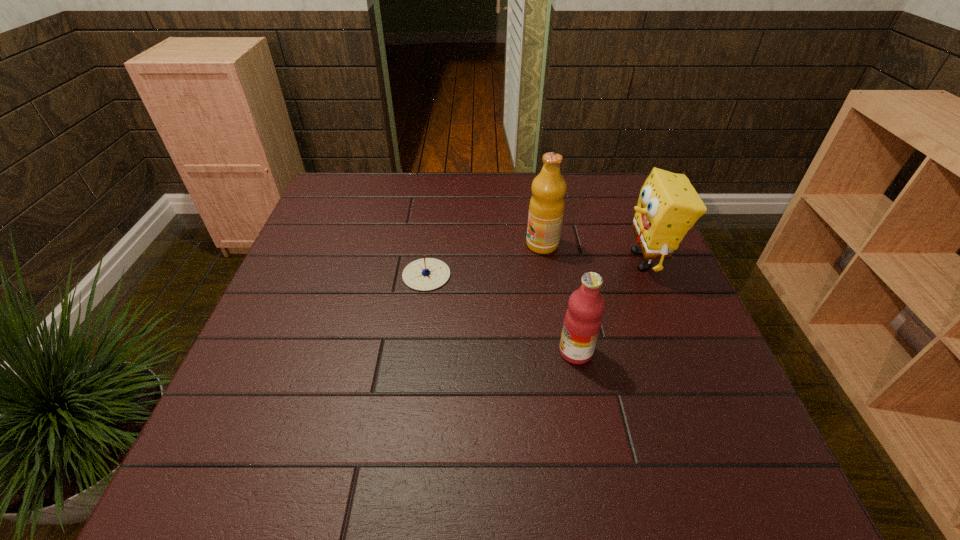
Where is `the taller fruit juice`? This screenshot has width=960, height=540. the taller fruit juice is located at coordinates (546, 208).

Identify the location of the rightmost object. The height and width of the screenshot is (540, 960). (668, 206).

The width and height of the screenshot is (960, 540). What are the coordinates of `the nearer fruit juice` in the screenshot? It's located at (583, 318).

Locate an element on the screen. the shorter fruit juice is located at coordinates (583, 318).

At what (x,y) coordinates should I click in order to perform the action: click on compass. Please return your answer as a coordinate pair (x, y). Image resolution: width=960 pixels, height=540 pixels. Looking at the image, I should click on (425, 274).

Find the location of `the shortest object`. the shortest object is located at coordinates (425, 274).

The width and height of the screenshot is (960, 540). In order to click on free location located 0.120m on the front label of the farther fruit juice in this screenshot , I will do `click(481, 245)`.

This screenshot has width=960, height=540. What are the coordinates of `free space located 0.210m on the front label of the farther fruit juice` in the screenshot? It's located at (448, 245).

I want to click on vacant space positioned 0.180m on the front label of the farther fruit juice, so click(x=459, y=245).

You are a GUI agent. You are given a task and a screenshot of the screen. Output one action in this format:
    pyautogui.click(x=<x>, y=<y>)
    Task: Click on the vacant space located on the face of the rightmost object
    This screenshot has height=540, width=960.
    Given the screenshot: What is the action you would take?
    pyautogui.click(x=500, y=260)